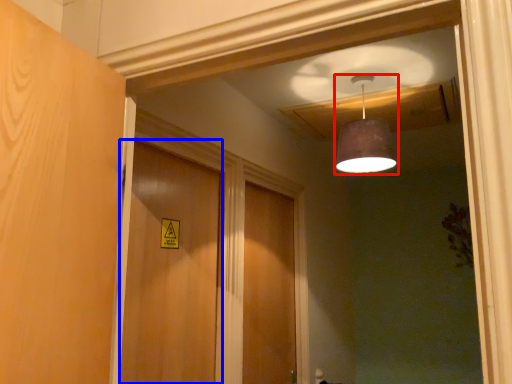
Question: Among these objects, which one is farthest to the camera, lamp (highlighted by a red box) or door (highlighted by a blue box)?

Choices:
 (A) lamp
 (B) door

Answer: (A)